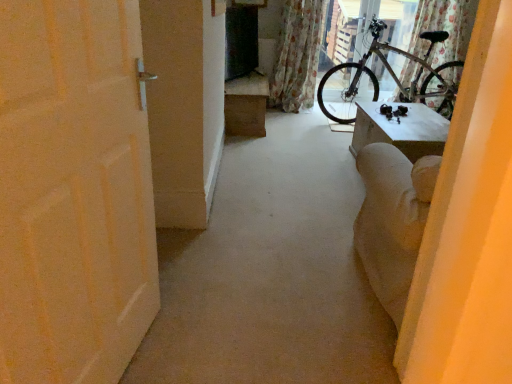
Question: From a real-world perspective, relative to silver metallic bicycle at upper right, is brown cardboard box at center vertically above or below?

Choices:
 (A) below
 (B) above

Answer: (A)

Question: Is point (237, 117) positioned closer to the camera than point (381, 56)?

Choices:
 (A) farther
 (B) closer

Answer: (B)

Question: Which object is positioned closest to the floral fabric curtain at upper right, which is counted as the 1th curtain, starting from the right?

Choices:
 (A) white matte door at left
 (B) silver metallic bicycle at upper right
 (C) brown cardboard box at center
 (D) floral fabric curtain at upper right, which is counted as the 2th curtain, starting from the right
 (E) white matte door at left

Answer: (B)

Question: Based on their relative distances, which object is nearer to the floral fabric curtain at upper right, which is counted as the 2th curtain, starting from the right?

Choices:
 (A) white matte door at left
 (B) silver metallic bicycle at upper right
 (C) white matte door at left
 (D) floral fabric curtain at upper right, which is the second curtain in left-to-right order
 (E) brown cardboard box at center

Answer: (B)